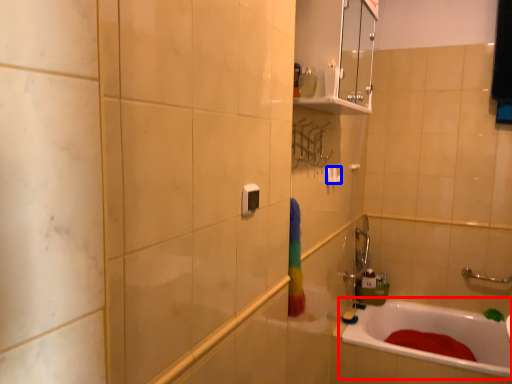
Question: Which object appears farthest to the camera in this image, bathtub (highlighted by a red box) or towel bar (highlighted by a blue box)?

Choices:
 (A) bathtub
 (B) towel bar

Answer: (B)